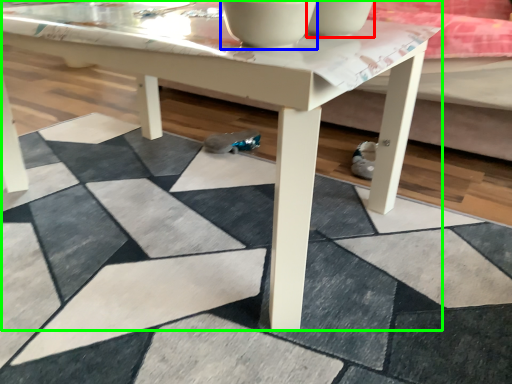
Question: Which object is positioned farthest from bowl (highlighted by a red box)? Select from bowl (highlighted by a blue box) and coffee table (highlighted by a green box).

Choices:
 (A) bowl
 (B) coffee table

Answer: (B)